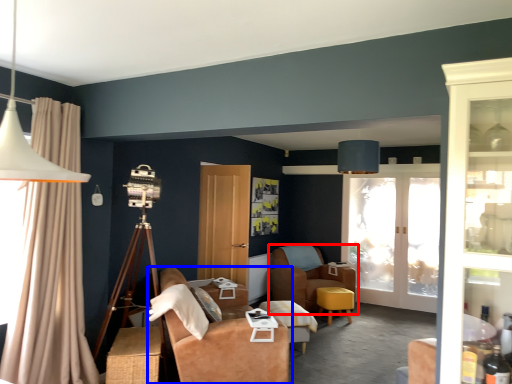
Question: Which object is closer to the camera taking this photo, chair (highlighted by a red box) or studio couch (highlighted by a blue box)?

Choices:
 (A) chair
 (B) studio couch

Answer: (B)